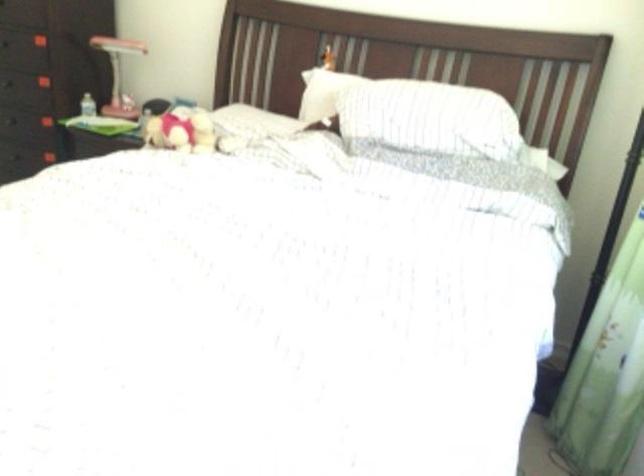
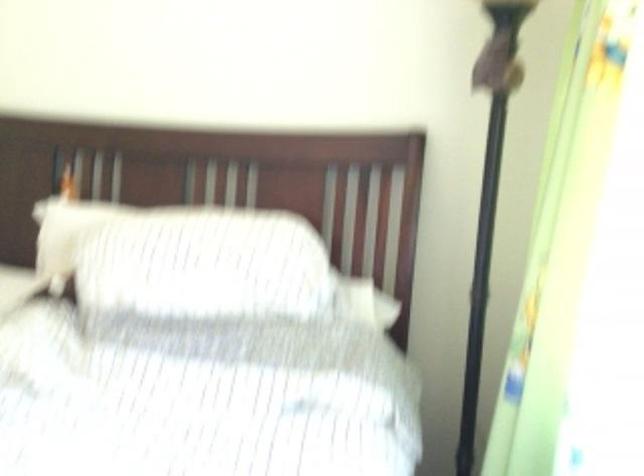
In a continuous first-person perspective shot, in which direction is the camera moving?

The cameraman moved toward right, forward.